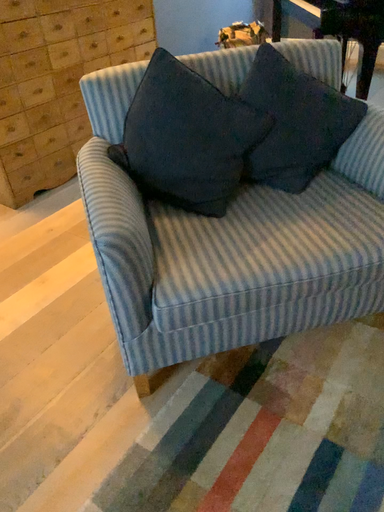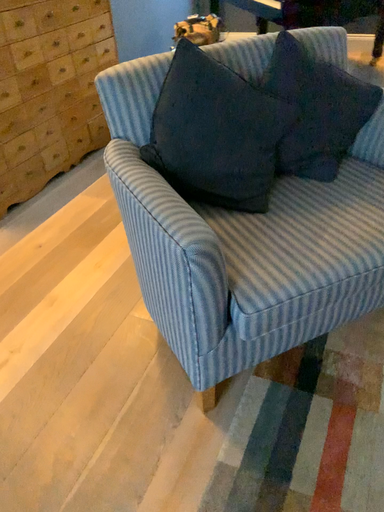
Question: Which way did the camera rotate in the video?

Choices:
 (A) rotated right
 (B) rotated left

Answer: (A)